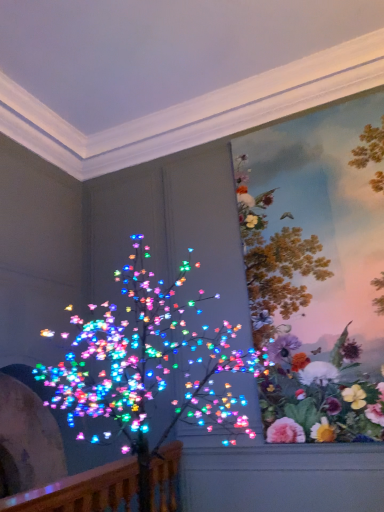
Find the location of a particular element. This screenshot has height=512, width=384. floral wallpaper at upper right is located at coordinates (297, 337).

Considering the relative sizes of wooden at left and floral wallpaper at upper right in the image provided, is wooden at left shorter than floral wallpaper at upper right?

Indeed, wooden at left has a lesser height compared to floral wallpaper at upper right.

From the picture: Does wooden at left have a smaller size compared to floral wallpaper at upper right?

Yes, wooden at left is smaller than floral wallpaper at upper right.

Is wooden at left not within floral wallpaper at upper right?

Absolutely, wooden at left is external to floral wallpaper at upper right.

Who is smaller, floral wallpaper at upper right or wooden at left?

wooden at left.

From a real-world perspective, which object rests below the other?

wooden at left, from a real-world perspective.

Is floral wallpaper at upper right turned away from wooden at left?

floral wallpaper at upper right does not have its back to wooden at left.

Would you say wooden at left is outside multicolored lights at left?

No, wooden at left is inside or overlapping with multicolored lights at left.

Looking at this image, is wooden at left directly adjacent to multicolored lights at left?

wooden at left and multicolored lights at left are not in contact.

Is wooden at left facing away from multicolored lights at left?

Yes, wooden at left is positioned with its back facing multicolored lights at left.

How many degrees apart are the facing directions of wooden at left and multicolored lights at left?

The facing directions of wooden at left and multicolored lights at left are 0.235 degrees apart.

From the image's perspective, is multicolored lights at left located above floral wallpaper at upper right?

Incorrect, from the image's perspective, multicolored lights at left is lower than floral wallpaper at upper right.

Which object is positioned more to the right, multicolored lights at left or floral wallpaper at upper right?

floral wallpaper at upper right.

Where is `christmas decoration below the floral wallpaper at upper right (from the image's perspective)`? The width and height of the screenshot is (384, 512). christmas decoration below the floral wallpaper at upper right (from the image's perspective) is located at coordinates (148, 366).

Is point (135, 450) behind point (245, 245)?

No, it is not.

Between floral wallpaper at upper right and multicolored lights at left, which one has smaller width?

floral wallpaper at upper right.

Does point (346, 380) come closer to viewer compared to point (223, 362)?

No, it is behind (223, 362).

Are floral wallpaper at upper right and multicolored lights at left making contact?

There is a gap between floral wallpaper at upper right and multicolored lights at left.

From the image's perspective, which is below, floral wallpaper at upper right or multicolored lights at left?

From the image's view, multicolored lights at left is below.

From the image's perspective, which is above, multicolored lights at left or wooden at left?

From the image's view, multicolored lights at left is above.

Considering the points (101, 320) and (175, 492), which point is behind, point (101, 320) or point (175, 492)?

The point (101, 320) is more distant.

Is multicolored lights at left in front of or behind wooden at left in the image?

multicolored lights at left is in front of wooden at left.

Is multicolored lights at left to the left or to the right of wooden at left in the image?

multicolored lights at left is to the right of wooden at left.

At what (x,y) coordinates should I click in order to perform the action: click on rail below the floral wallpaper at upper right (from a real-world perspective). Please return your answer as a coordinate pair (x, y). Looking at the image, I should click on pyautogui.click(x=82, y=490).

Where is `rail below the floral wallpaper at upper right (from the image's perspective)`? The image size is (384, 512). rail below the floral wallpaper at upper right (from the image's perspective) is located at coordinates (82, 490).

Considering their positions, is multicolored lights at left positioned further to floral wallpaper at upper right than wooden at left?

Based on the image, wooden at left appears to be further to floral wallpaper at upper right.

Based on their spatial positions, is floral wallpaper at upper right or wooden at left further from multicolored lights at left?

Among the two, wooden at left is located further to multicolored lights at left.

Estimate the real-world distances between objects in this image. Which object is further from wooden at left, multicolored lights at left or floral wallpaper at upper right?

Among the two, floral wallpaper at upper right is located further to wooden at left.

Considering their positions, is floral wallpaper at upper right positioned closer to wooden at left than multicolored lights at left?

multicolored lights at left is closer to wooden at left.

From the image, which object appears to be nearer to multicolored lights at left, wooden at left or floral wallpaper at upper right?

floral wallpaper at upper right is closer to multicolored lights at left.

Considering their positions, is wooden at left positioned closer to floral wallpaper at upper right than multicolored lights at left?

The object closer to floral wallpaper at upper right is multicolored lights at left.

Locate an element on the screen. christmas decoration between wooden at left and floral wallpaper at upper right in the horizontal direction is located at coordinates (148, 366).